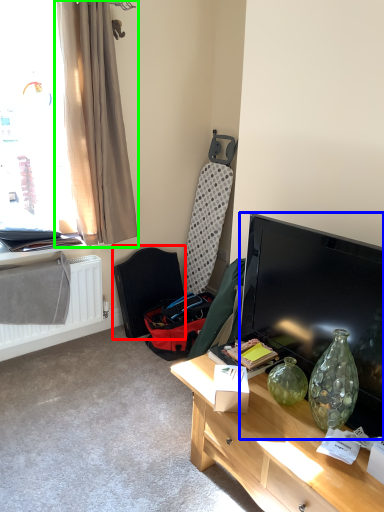
Question: Which object is the farthest from swivel chair (highlighted by a red box)? Choose among these: television (highlighted by a blue box) or curtain (highlighted by a green box).

Choices:
 (A) television
 (B) curtain

Answer: (A)